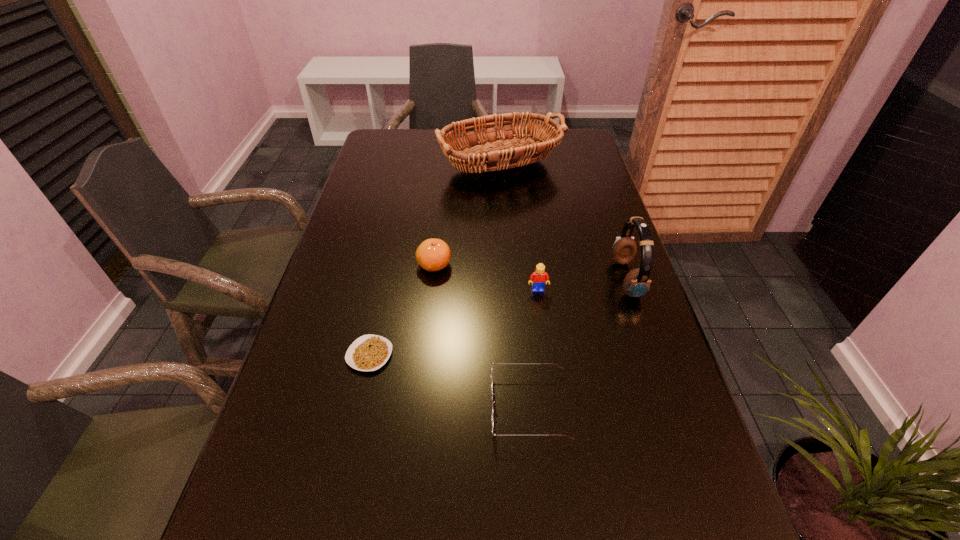
This screenshot has width=960, height=540. Identify the location of object located in the far right corner section of the desktop. (495, 152).

Where is `free spot at the left edge of the desktop`? The image size is (960, 540). free spot at the left edge of the desktop is located at coordinates coord(321,373).

This screenshot has width=960, height=540. In order to click on vacant region at the right edge of the desktop in this screenshot , I will do `click(604, 358)`.

Image resolution: width=960 pixels, height=540 pixels. In the image, there is a desktop. What are the coordinates of `blank space at the far left corner` in the screenshot? It's located at (375, 148).

Where is `free space between the legume and the headset`? The width and height of the screenshot is (960, 540). free space between the legume and the headset is located at coordinates (498, 317).

Image resolution: width=960 pixels, height=540 pixels. In order to click on vacant area that lies between the shortest object and the clementine in this screenshot , I will do `click(402, 310)`.

Find the location of a particular element. blank region between the sunglasses and the farthest object is located at coordinates (511, 286).

The height and width of the screenshot is (540, 960). I want to click on vacant point located between the third shortest object and the sunglasses, so click(482, 336).

Where is `vacant area that lies between the clementine and the basket`? The width and height of the screenshot is (960, 540). vacant area that lies between the clementine and the basket is located at coordinates (463, 215).

The width and height of the screenshot is (960, 540). In order to click on vacant area between the sunglasses and the farthest object in this screenshot , I will do `click(511, 286)`.